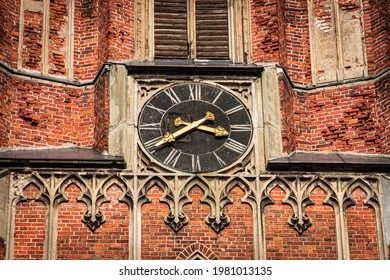
Identify the location of clock hands. (183, 130), (202, 128).